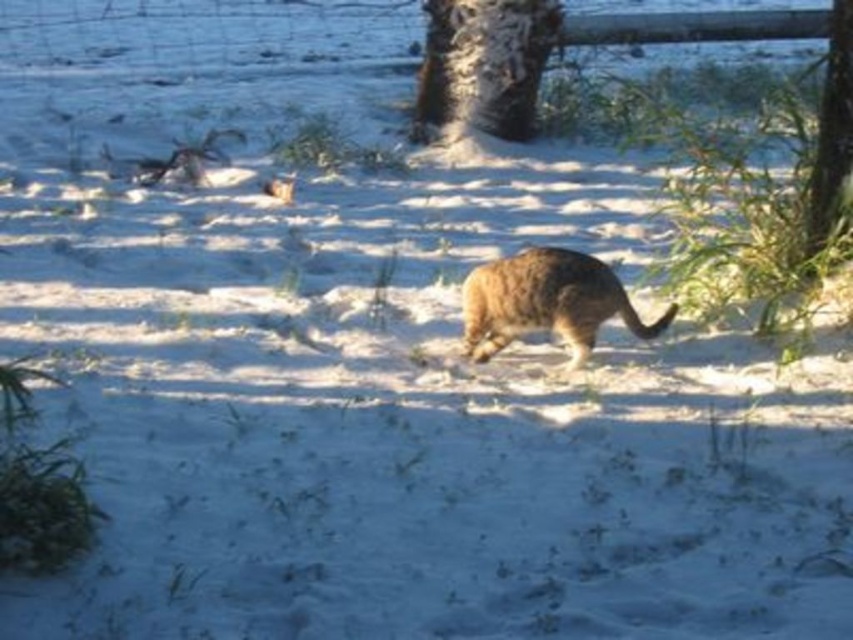
You are observing a cat walking away from you on a sandy beach. There are two points marked on the sand. One is at coordinate point [595,268] and the other is at point [840,141]. Which point is closer to your current position?

Point [595,268] is closer to the camera than point [840,141].

You are a photographer trying to capture the fuzzy brown cat at center and the brown textured tree trunk at right in the same frame. Based on their sizes, which object would appear larger in the photo?

The brown textured tree trunk at right would appear larger in the photo because it is taller than the fuzzy brown cat at center.